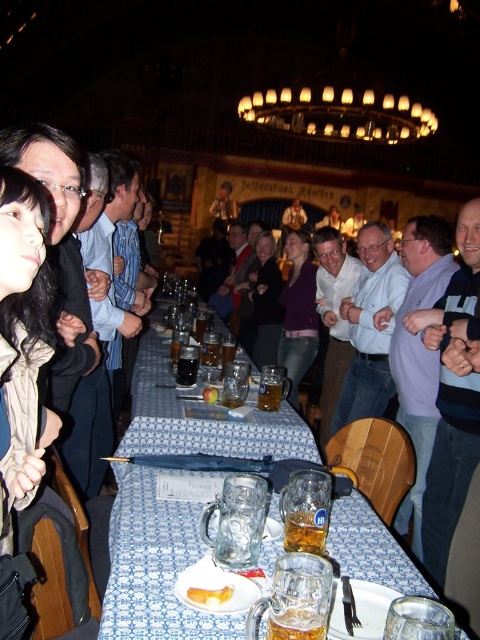
Image resolution: width=480 pixels, height=640 pixels. Identify the location of translucent glass mug at lower center. (296, 625).

Between point (299, 621) and point (192, 596), which one is positioned behind?

Point (192, 596)

Between point (295, 618) and point (200, 589), which one is positioned in front?

Point (295, 618) is more forward.

The image size is (480, 640). Identify the location of translucent glass mug at lower center. (296, 625).

Measure the distance from translucent glass mug at center to translucent glass beer mug at table center.

1.56 meters

Is translucent glass mug at center wider than translucent glass beer mug at table center?

Yes, translucent glass mug at center is wider than translucent glass beer mug at table center.

Where is `translucent glass mug at center`? The height and width of the screenshot is (640, 480). translucent glass mug at center is located at coordinates (305, 531).

At what (x,y) coordinates should I click in order to perform the action: click on translucent glass mug at center. Please return your answer as a coordinate pair (x, y). Looking at the image, I should click on (305, 531).

Does yellowish matte bread at lower center appear on the right side of translucent glass beer mug at table center?

Yes, yellowish matte bread at lower center is to the right of translucent glass beer mug at table center.

Locate an element on the screen. This screenshot has height=640, width=480. yellowish matte bread at lower center is located at coordinates (x=210, y=595).

Which is behind, point (229, 589) or point (216, 387)?

The point (216, 387) is more distant.

The width and height of the screenshot is (480, 640). I want to click on yellowish matte bread at lower center, so click(210, 595).